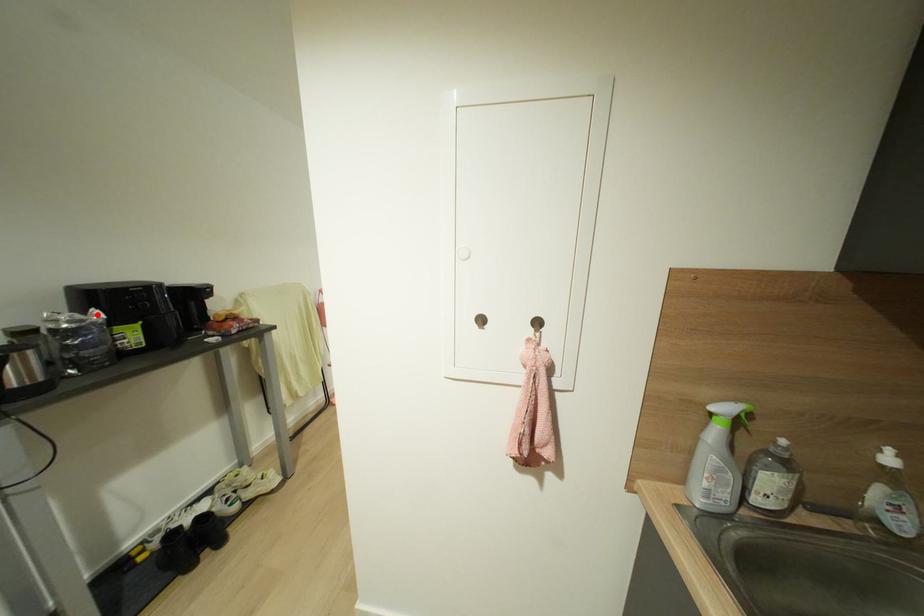
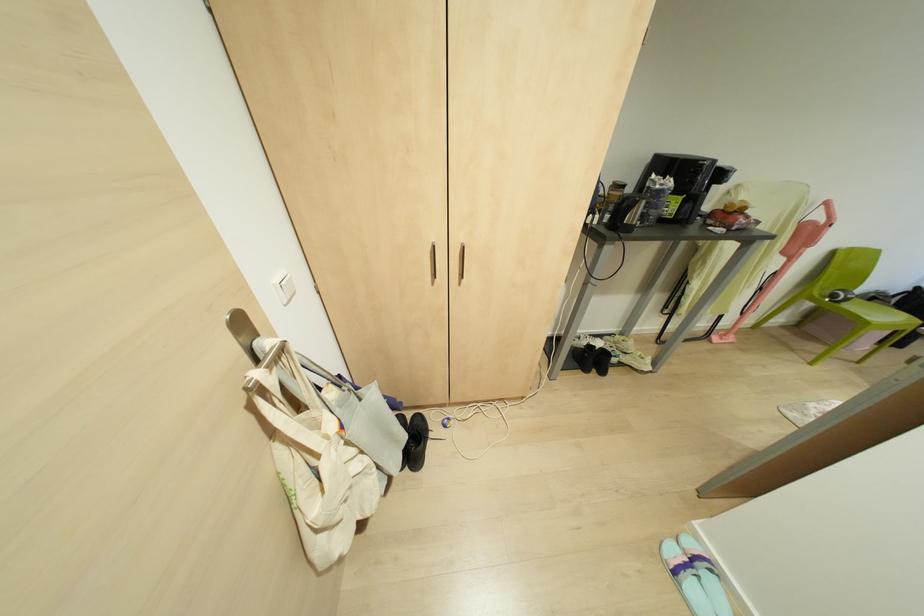
The point at the highlighted location is marked in the first image. Where is the corresponding point in the second image?

(670, 182)